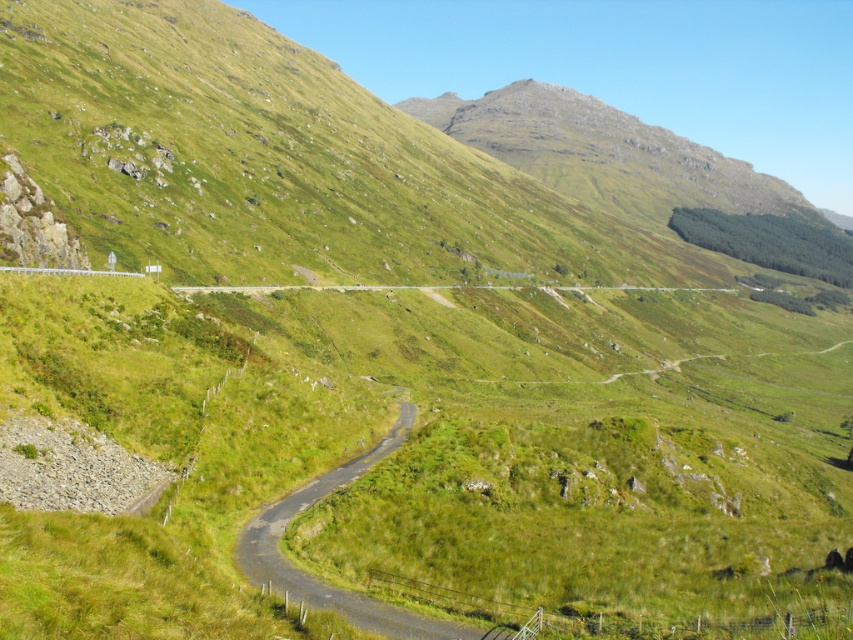
You are a hiker standing at the starting point of the winding road in the valley. You see two points marked on the map as point 1 at coordinates (526, 122) and point 2 at coordinates (259, 572). Which point is closer to your current position?

Point 1 at coordinates (526, 122) is closer to your current position because it is further to the viewer than point 2 at coordinates (259, 572).

You are a hiker planning to walk from the green asphalt road at center to the green grassy mountain at upper center. According to the image, which direction should you head relative to the road?

The green grassy mountain at upper center is positioned on the right side of the green asphalt road at center, so you should head towards the right side of the road to reach it.